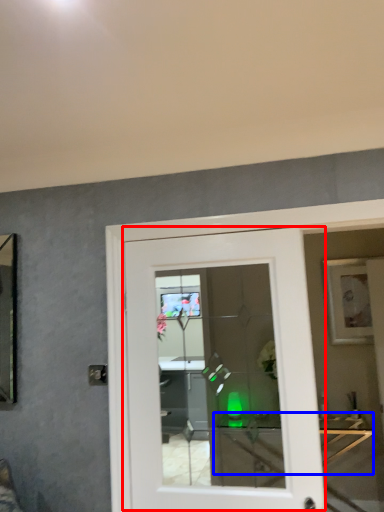
Question: Among these objects, which one is farthest to the camera, door (highlighted by a red box) or table (highlighted by a blue box)?

Choices:
 (A) door
 (B) table

Answer: (B)